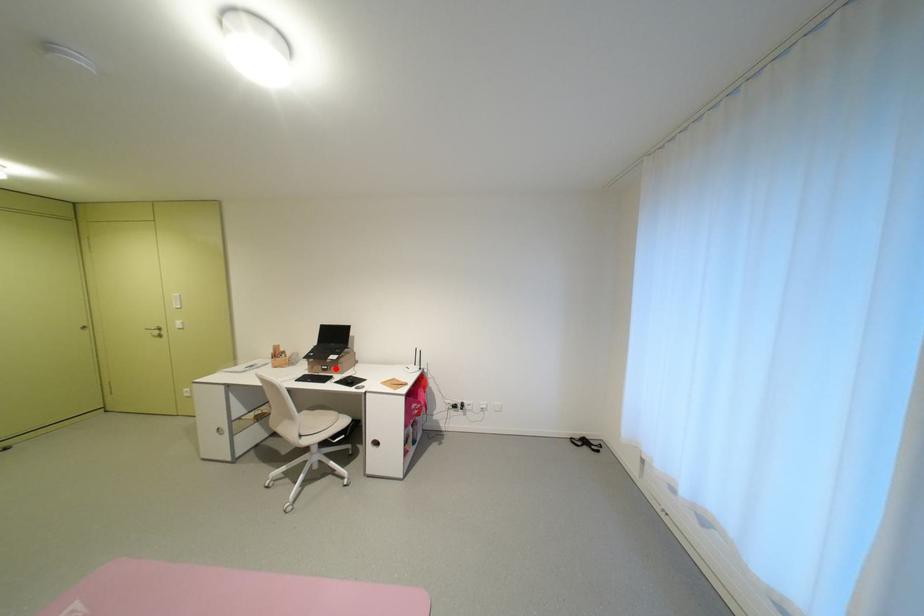
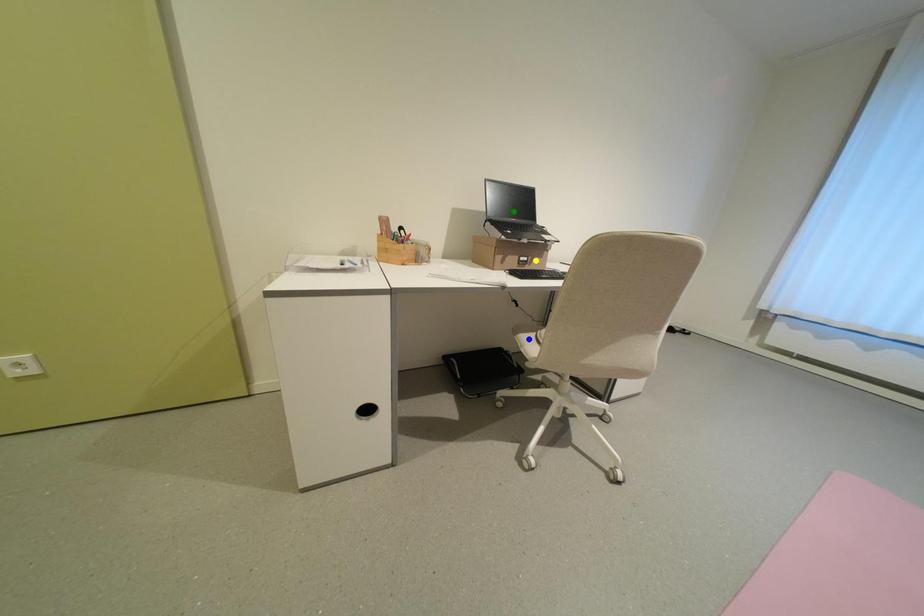
Question: I am providing you with two images of the same scene from different viewpoints. A red point is marked on the first image. You are given multiple points on the second image. Which point in image 2 represents the same 3d spot as the red point in image 1?

Choices:
 (A) green point
 (B) yellow point
 (C) blue point

Answer: (B)